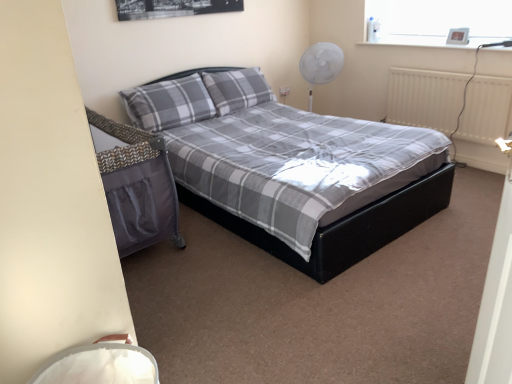
Locate an element on the screen. vacant area on top of white matte radiator at right (from a real-world perspective) is located at coordinates pos(459,71).